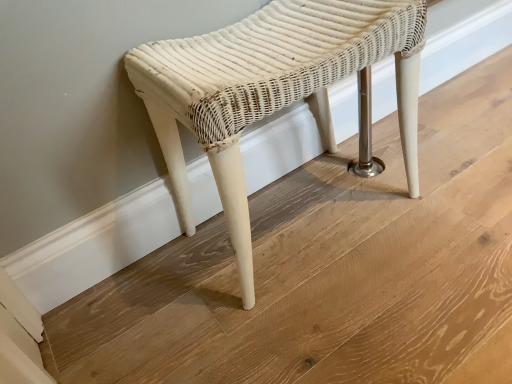
The width and height of the screenshot is (512, 384). Identify the location of white wicker stool at center. (276, 90).

This screenshot has width=512, height=384. What do you see at coordinates (276, 90) in the screenshot?
I see `white wicker stool at center` at bounding box center [276, 90].

Image resolution: width=512 pixels, height=384 pixels. Identify the location of white wicker stool at center. (276, 90).